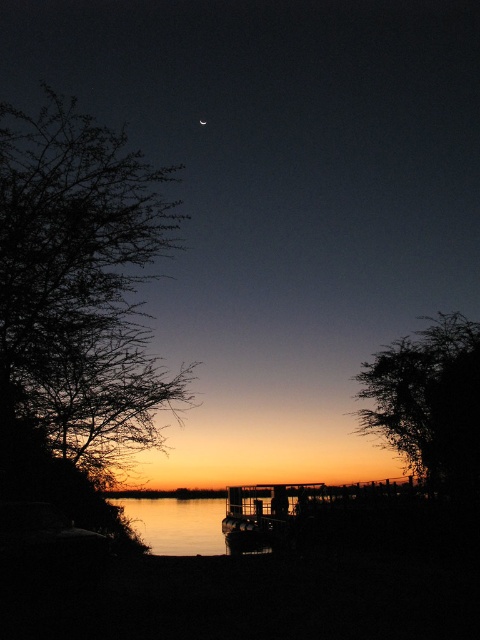
Is silhouette leafy tree at left to the right of silhouette leafy tree at right from the viewer's perspective?

No, silhouette leafy tree at left is not to the right of silhouette leafy tree at right.

Which is in front, point (33, 202) or point (458, 484)?

Point (33, 202)

You are a GUI agent. You are given a task and a screenshot of the screen. Output one action in this format:
    pyautogui.click(x=<x>, y=<y>)
    Task: Click on the silhouette leafy tree at left
    Image resolution: width=480 pixels, height=640 pixels.
    Given the screenshot: What is the action you would take?
    pyautogui.click(x=81, y=284)

Based on the photo, is silhouette leafy tree at right wider than silhouette wooden dock at center?

No, silhouette leafy tree at right is not wider than silhouette wooden dock at center.

Who is taller, silhouette leafy tree at right or silhouette wooden dock at center?

silhouette leafy tree at right

Is point (456, 456) in front of point (266, 509)?

That is True.

Identify the location of silhouette leafy tree at right. Image resolution: width=480 pixels, height=640 pixels. (429, 401).

Which is behind, point (160, 369) or point (200, 120)?

Positioned behind is point (200, 120).

Which is behind, point (129, 164) or point (204, 124)?

The point (204, 124) is more distant.

The image size is (480, 640). Find the location of `silhouette leafy tree at left`. silhouette leafy tree at left is located at coordinates (81, 284).